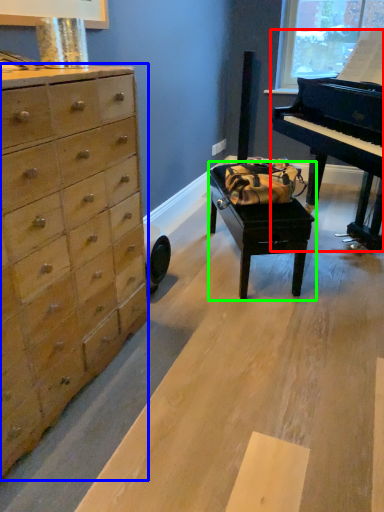
Question: Considering the real-world distances, which object is closest to piano (highlighted by a red box)? chest of drawers (highlighted by a blue box) or table (highlighted by a green box).

Choices:
 (A) chest of drawers
 (B) table

Answer: (B)